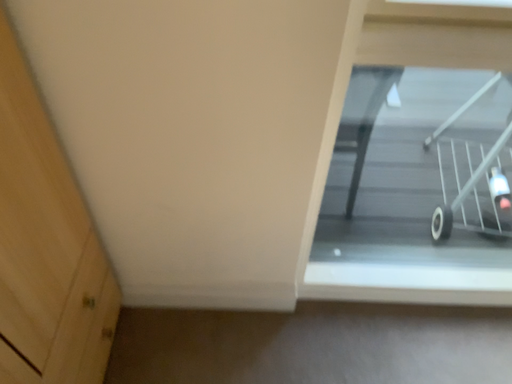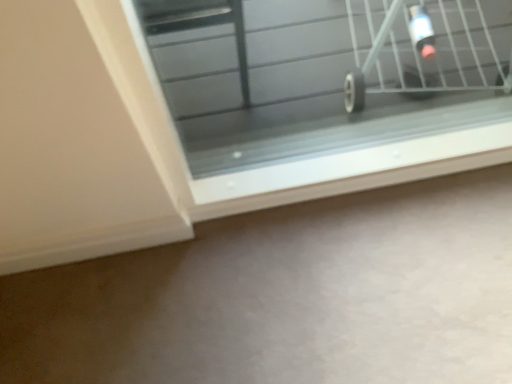
Question: Which way did the camera rotate in the video?

Choices:
 (A) rotated left
 (B) rotated right

Answer: (B)